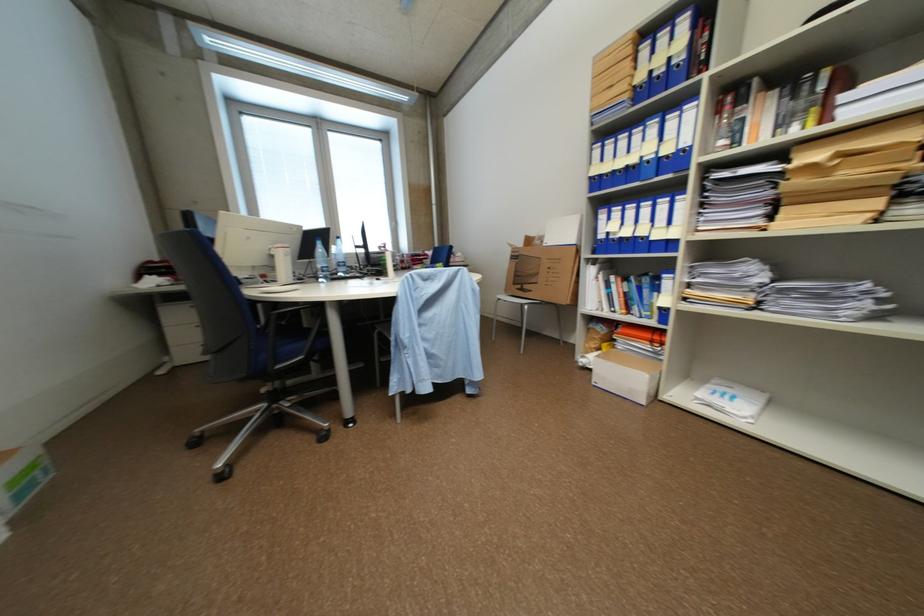
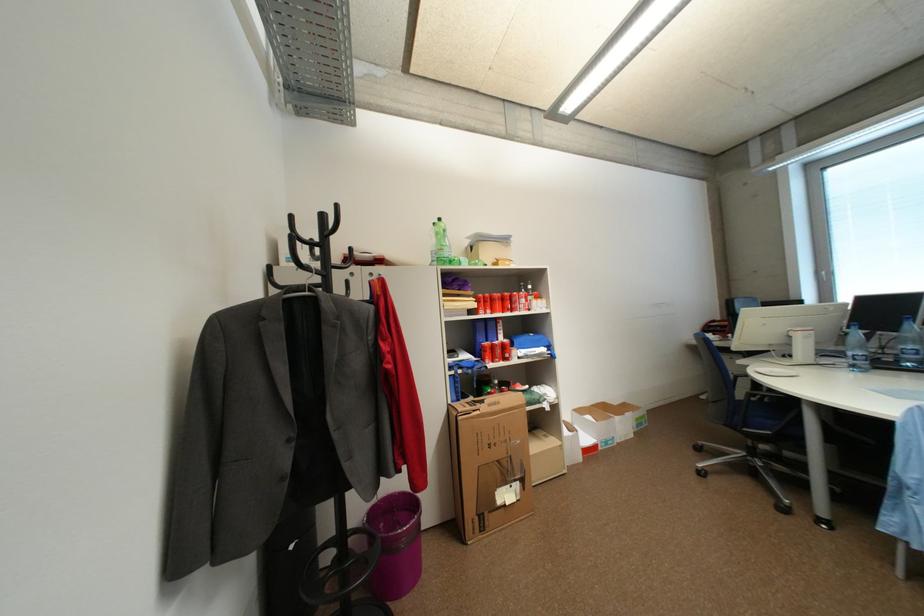
Locate, in the second image, the point that corresponds to point 333,277 in the first image.

(861, 367)